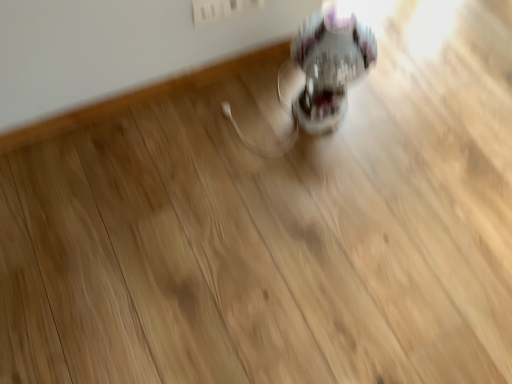
This screenshot has height=384, width=512. Identify the location of free space on the front side of translucent plastic swivel chair at center. [x=316, y=159].